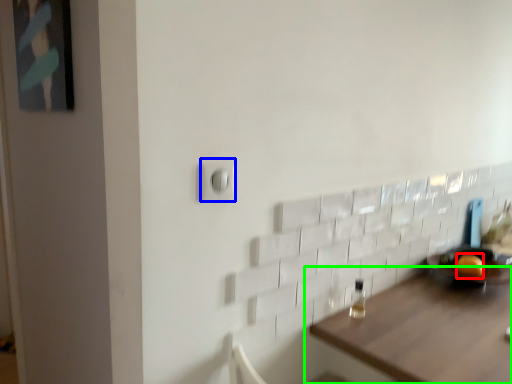
Question: Estimate the real-world distances between objects in this image. Which object is farther from orange (highlighted by a red box), light switch (highlighted by a blue box) or table (highlighted by a green box)?

Choices:
 (A) light switch
 (B) table

Answer: (A)